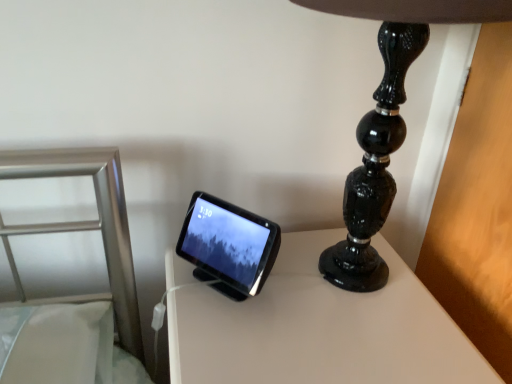
Question: Is white glossy table at center wider than black glossy lamp at upper right?

Choices:
 (A) no
 (B) yes

Answer: (B)

Question: From a real-world perspective, is white glossy table at center positioned over black glossy lamp at upper right based on gravity?

Choices:
 (A) no
 (B) yes

Answer: (A)

Question: Could black glossy lamp at upper right be considered to be inside white glossy table at center?

Choices:
 (A) yes
 (B) no

Answer: (B)

Question: From a real-world perspective, is white glossy table at center physically below black glossy lamp at upper right?

Choices:
 (A) no
 (B) yes

Answer: (B)

Question: Does white glossy table at center turn towards black glossy lamp at upper right?

Choices:
 (A) yes
 (B) no

Answer: (B)

Question: Would you say white glossy table at center is to the left or to the right of black glossy lamp at upper right in the picture?

Choices:
 (A) left
 (B) right

Answer: (A)

Question: Looking at the image, does white glossy table at center seem bigger or smaller compared to black glossy lamp at upper right?

Choices:
 (A) small
 (B) big

Answer: (B)

Question: Which is correct: white glossy table at center is inside black glossy lamp at upper right, or outside of it?

Choices:
 (A) outside
 (B) inside

Answer: (A)

Question: Considering their positions, is white glossy table at center located in front of or behind black glossy lamp at upper right?

Choices:
 (A) front
 (B) behind

Answer: (B)

Question: In terms of size, does matte black tablet at center appear bigger or smaller than white glossy table at center?

Choices:
 (A) small
 (B) big

Answer: (A)

Question: Does point (262, 271) appear closer or farther from the camera than point (365, 292)?

Choices:
 (A) closer
 (B) farther

Answer: (A)

Question: Looking at their shapes, would you say matte black tablet at center is wider or thinner than white glossy table at center?

Choices:
 (A) wide
 (B) thin

Answer: (B)

Question: Considering the relative positions of matte black tablet at center and white glossy table at center in the image provided, is matte black tablet at center to the left or to the right of white glossy table at center?

Choices:
 (A) left
 (B) right

Answer: (A)

Question: In terms of width, does white glossy table at center look wider or thinner when compared to matte black tablet at center?

Choices:
 (A) thin
 (B) wide

Answer: (B)

Question: From the image's perspective, is white glossy table at center above or below matte black tablet at center?

Choices:
 (A) above
 (B) below

Answer: (B)